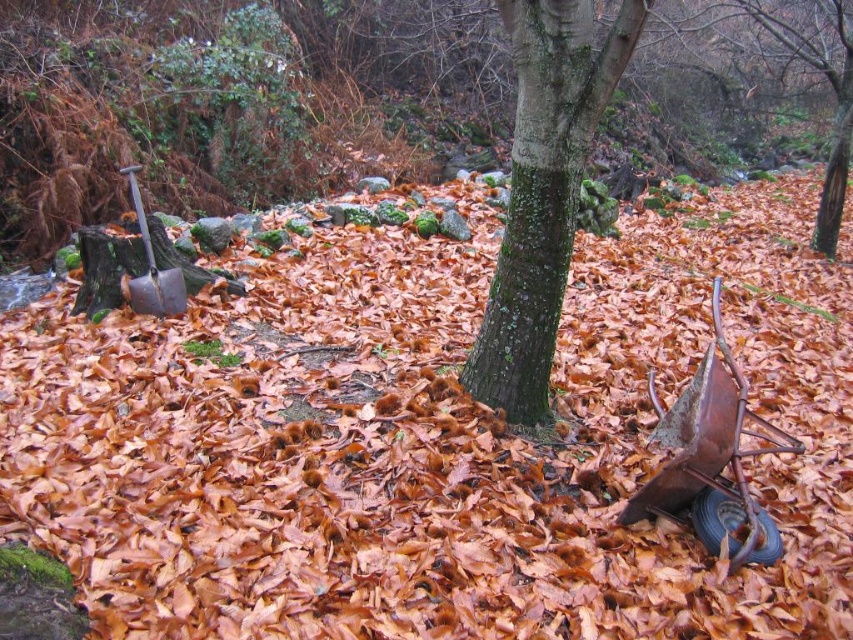
You are a hiker who has just found a shiny metallic shovel at left and a green mossy bark tree at center in an autumn forest. Which object is positioned further to the left?

The shiny metallic shovel at left is positioned further to the left than the green mossy bark tree at center.

Based on the photo, you are a hiker who has just arrived at this autumn forest scene. You need to determine which object is larger between the green mossy bark tree at center and the shiny metallic shovel at left. Based on the scene, which one is bigger?

The green mossy bark tree at center is bigger than the shiny metallic shovel at left according to the description.